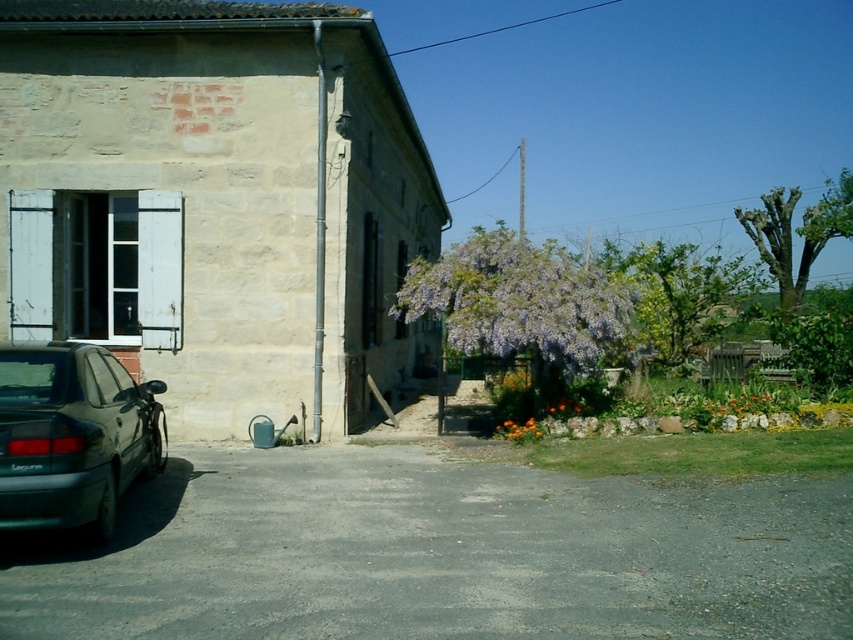
Looking at this image, does gray asphalt driveway at lower center lie in front of purple leafy tree at center?

Yes, gray asphalt driveway at lower center is closer to the viewer.

Locate an element on the screen. gray asphalt driveway at lower center is located at coordinates (439, 554).

The height and width of the screenshot is (640, 853). In order to click on gray asphalt driveway at lower center in this screenshot , I will do `click(439, 554)`.

Image resolution: width=853 pixels, height=640 pixels. Describe the element at coordinates (439, 554) in the screenshot. I see `gray asphalt driveway at lower center` at that location.

Find the location of a particular element. gray asphalt driveway at lower center is located at coordinates (439, 554).

You are a GUI agent. You are given a task and a screenshot of the screen. Output one action in this format:
    pyautogui.click(x=<x>, y=<y>)
    Task: Click on the gray asphalt driveway at lower center
    
    Given the screenshot: What is the action you would take?
    pyautogui.click(x=439, y=554)

Describe the element at coordinates (798, 232) in the screenshot. I see `green leafy tree at upper right` at that location.

Identify the location of green leafy tree at upper right. (798, 232).

Who is more forward, (778,256) or (523,428)?

Point (523,428) is in front.

Where is `green leafy tree at upper right`? The height and width of the screenshot is (640, 853). green leafy tree at upper right is located at coordinates (798, 232).